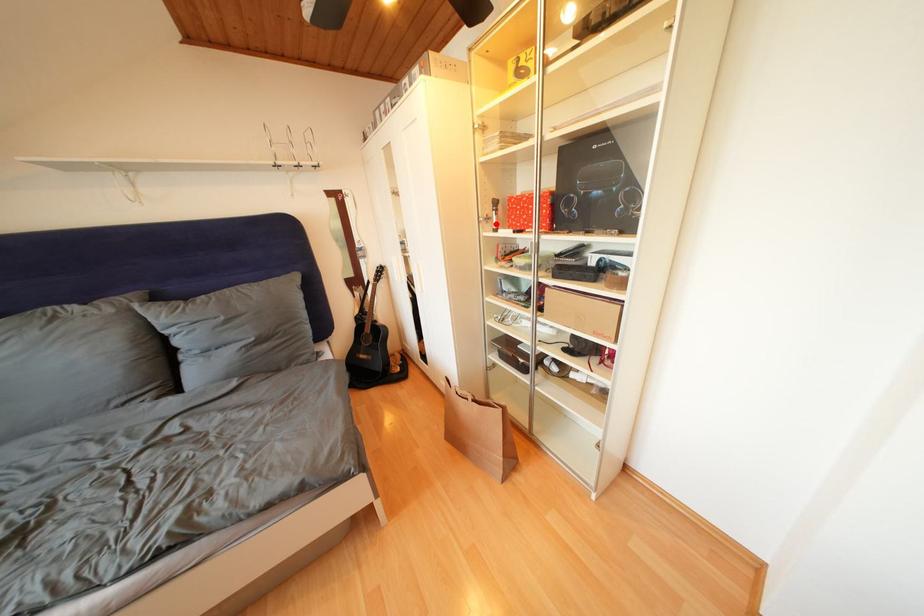
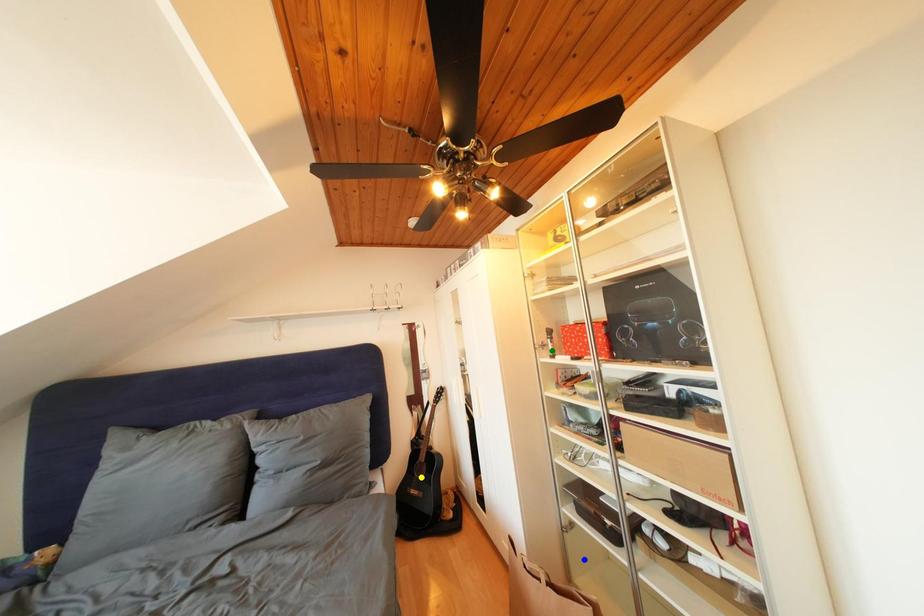
Question: I am providing you with two images of the same scene from different viewpoints. A red point is marked on the first image. You are given multiple points on the second image. Which spot in image 2 lines up with the point in image 1?

Choices:
 (A) green point
 (B) yellow point
 (C) blue point

Answer: (A)